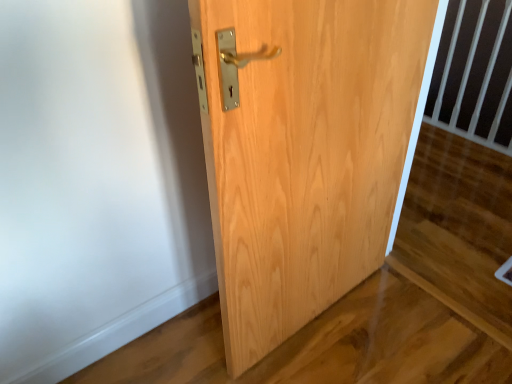
Locate an element on the screen. The width and height of the screenshot is (512, 384). vacant space to the left of black plastic balustrade at upper right is located at coordinates (433, 139).